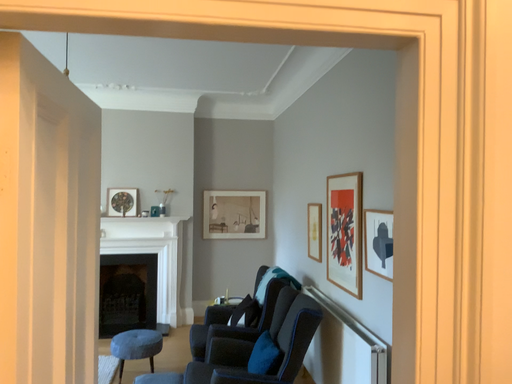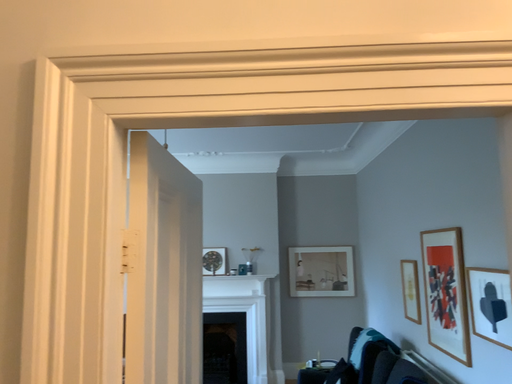
Question: Which way did the camera rotate in the video?

Choices:
 (A) rotated upward
 (B) rotated downward

Answer: (A)